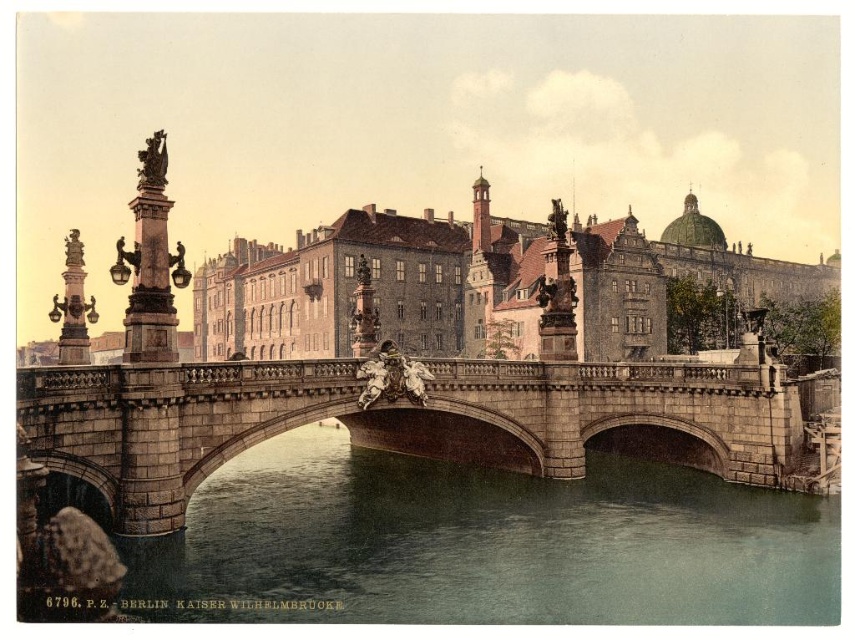
Does greenish stone water at center have a larger size compared to stone bridge at center?

No, greenish stone water at center is not bigger than stone bridge at center.

Is point (257, 500) positioned behind point (441, 378)?

Yes, point (257, 500) is behind point (441, 378).

The width and height of the screenshot is (855, 640). I want to click on greenish stone water at center, so click(x=482, y=545).